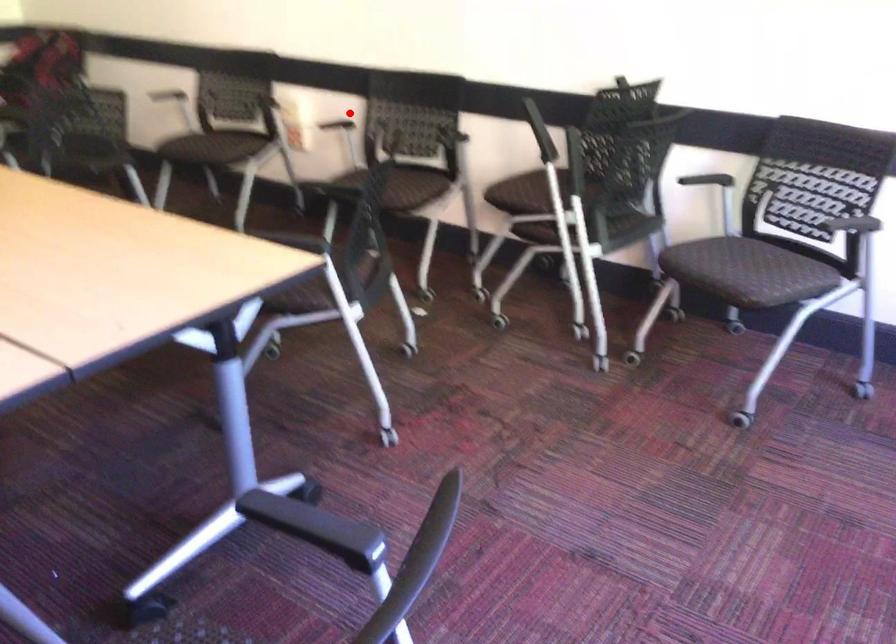
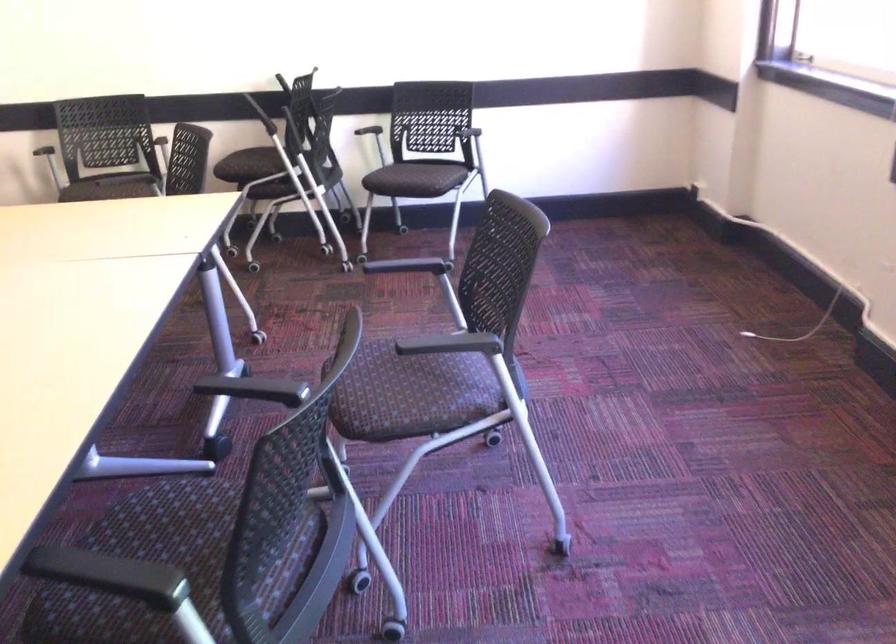
Where in the second image is the point corresponding to the highlighted location from the first image?

(30, 140)